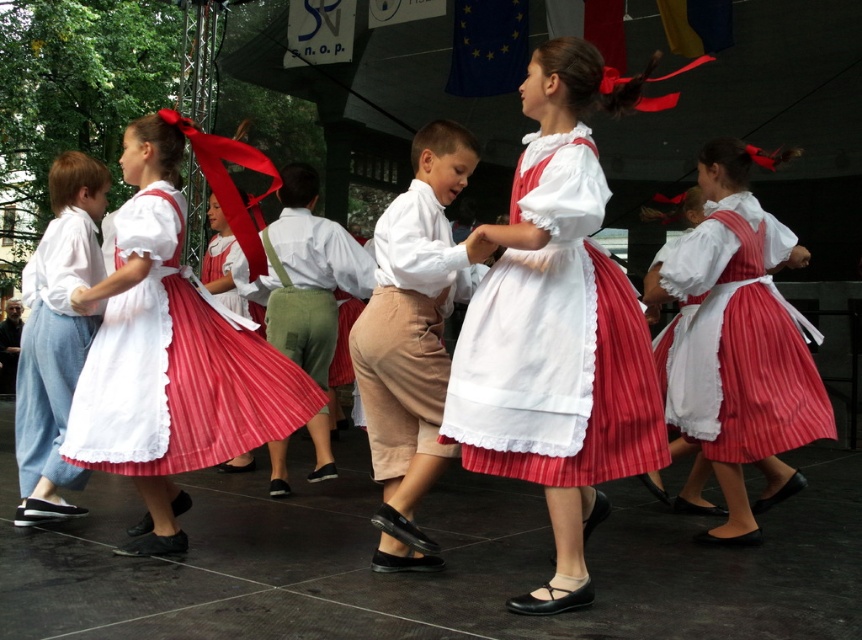
Does matte red skirt at right lie in front of matte white skirt at left?

No, it is behind matte white skirt at left.

Is point (747, 412) positioned before point (29, 451)?

Yes, it is in front of point (29, 451).

Identify the location of matte red skirt at right. (740, 340).

Looking at this image, who is more forward, (626, 328) or (297, 392)?

Point (626, 328) is in front.

Looking at this image, which is below, white pleated dress at center or matte white dress at left?

matte white dress at left is below.

This screenshot has height=640, width=862. Describe the element at coordinates (556, 348) in the screenshot. I see `white pleated dress at center` at that location.

Image resolution: width=862 pixels, height=640 pixels. What are the coordinates of `white pleated dress at center` in the screenshot? It's located at (556, 348).

Does point (558, 337) come behind point (767, 307)?

No, (558, 337) is closer to viewer.

Which is more to the right, white pleated dress at center or matte red skirt at right?

Positioned to the right is matte red skirt at right.

Does point (569, 228) come closer to viewer compared to point (797, 365)?

Yes, point (569, 228) is closer to viewer.

Where is `white pleated dress at center`? This screenshot has width=862, height=640. white pleated dress at center is located at coordinates (556, 348).